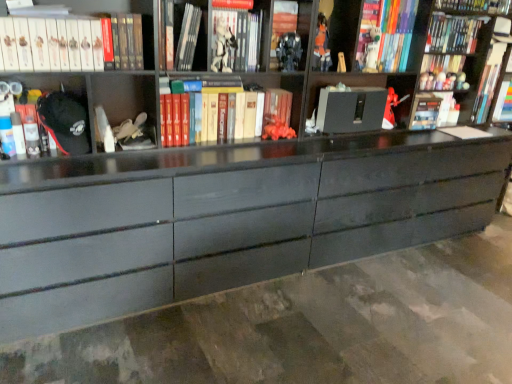
Question: Are hardcover book at upper center, which is the 5th book from right to left, and hardcover book at upper left, arranged as the second book when viewed from the left, beside each other?

Choices:
 (A) yes
 (B) no

Answer: (B)

Question: Is hardcover book at upper center, which is the 5th book from right to left, looking in the opposite direction of hardcover book at upper left, acting as the 9th book starting from the right?

Choices:
 (A) no
 (B) yes

Answer: (A)

Question: From the image's perspective, does hardcover book at upper center, which ranks as the 6th book in left-to-right order, appear higher than hardcover book at upper left, arranged as the second book when viewed from the left?

Choices:
 (A) no
 (B) yes

Answer: (B)

Question: From a real-world perspective, does hardcover book at upper center, which ranks as the 6th book in left-to-right order, sit lower than hardcover book at upper left, acting as the 9th book starting from the right?

Choices:
 (A) yes
 (B) no

Answer: (B)

Question: Is hardcover book at upper left, acting as the 9th book starting from the right, located within hardcover book at upper center, which ranks as the 6th book in left-to-right order?

Choices:
 (A) yes
 (B) no

Answer: (B)

Question: From a real-world perspective, relative to hardcover book at upper center, which is the 5th book from right to left, is hardcover book at upper left, marked as the 3th book in a left-to-right arrangement, vertically above or below?

Choices:
 (A) above
 (B) below

Answer: (B)

Question: In the image, is hardcover book at upper left, the eighth book viewed from the right, positioned in front of or behind hardcover book at upper center, which ranks as the 6th book in left-to-right order?

Choices:
 (A) front
 (B) behind

Answer: (A)

Question: Is hardcover book at upper left, the eighth book viewed from the right, inside the boundaries of hardcover book at upper center, which is the 5th book from right to left, or outside?

Choices:
 (A) outside
 (B) inside

Answer: (A)

Question: Is hardcover book at upper left, the eighth book viewed from the right, wider or thinner than hardcover book at upper center, which ranks as the 6th book in left-to-right order?

Choices:
 (A) wide
 (B) thin

Answer: (A)

Question: Is point (297, 43) positioned closer to the camera than point (373, 33)?

Choices:
 (A) closer
 (B) farther

Answer: (A)

Question: In the image, is metallic silver robot at center, which is the third toy from left to right, on the left side or the right side of matte plastic toy at upper right, acting as the second toy starting from the right?

Choices:
 (A) left
 (B) right

Answer: (A)

Question: Considering the positions of metallic silver robot at center, acting as the 4th toy starting from the back, and matte plastic toy at upper right, the fourth toy in the left-to-right sequence, in the image, is metallic silver robot at center, acting as the 4th toy starting from the back, bigger or smaller than matte plastic toy at upper right, the fourth toy in the left-to-right sequence,?

Choices:
 (A) big
 (B) small

Answer: (A)

Question: In the image, is metallic silver robot at center, which is the 2th toy in front-to-back order, positioned in front of or behind matte plastic toy at upper right, which appears as the fourth toy when viewed from the front?

Choices:
 (A) front
 (B) behind

Answer: (A)

Question: Is metallic silver robot at center, which is the third toy from left to right, inside or outside of white matte book at upper left, marked as the first book in a left-to-right arrangement?

Choices:
 (A) inside
 (B) outside

Answer: (B)

Question: Considering the positions of metallic silver robot at center, which ranks as the third toy in right-to-left order, and white matte book at upper left, marked as the tenth book in a right-to-left arrangement, in the image, is metallic silver robot at center, which ranks as the third toy in right-to-left order, wider or thinner than white matte book at upper left, marked as the tenth book in a right-to-left arrangement,?

Choices:
 (A) thin
 (B) wide

Answer: (A)